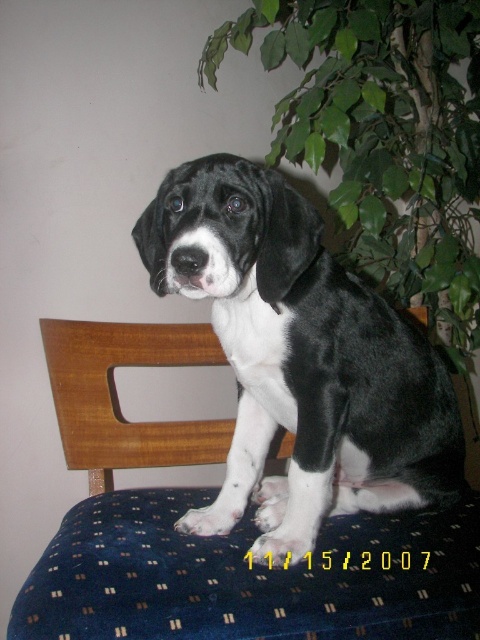
Question: Is black/white fur dog at center to the right of green leafy plant at upper right from the viewer's perspective?

Choices:
 (A) no
 (B) yes

Answer: (A)

Question: Based on their relative distances, which object is farther from the black/white fur dog at center?

Choices:
 (A) green leafy plant at upper right
 (B) wooden chair at center

Answer: (A)

Question: Can you confirm if wooden chair at center is positioned below green leafy plant at upper right?

Choices:
 (A) yes
 (B) no

Answer: (A)

Question: Estimate the real-world distances between objects in this image. Which object is farther from the wooden chair at center?

Choices:
 (A) black/white fur dog at center
 (B) green leafy plant at upper right

Answer: (B)

Question: Is black/white fur dog at center thinner than green leafy plant at upper right?

Choices:
 (A) yes
 (B) no

Answer: (A)

Question: Based on their relative distances, which object is farther from the wooden chair at center?

Choices:
 (A) green leafy plant at upper right
 (B) black/white fur dog at center

Answer: (A)